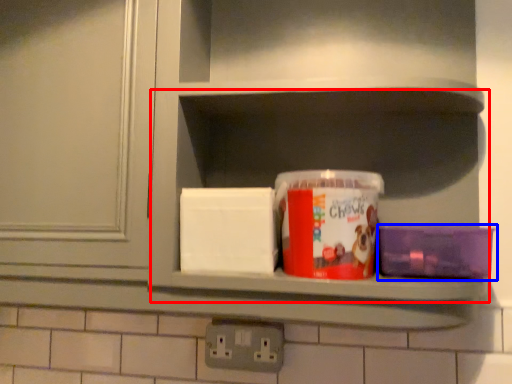
Question: Which object appears farthest to the camera in this image, cabinet (highlighted by a red box) or box (highlighted by a blue box)?

Choices:
 (A) cabinet
 (B) box

Answer: (B)